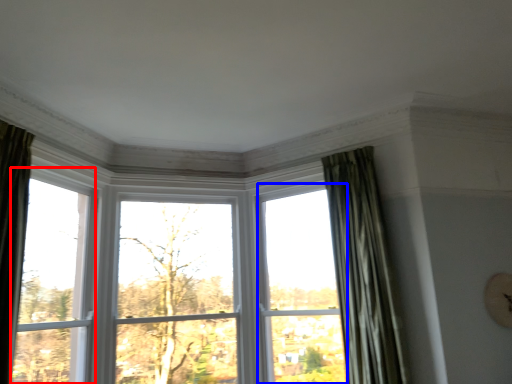
Question: Among these objects, which one is farthest to the camera, window (highlighted by a red box) or window (highlighted by a blue box)?

Choices:
 (A) window
 (B) window

Answer: (B)